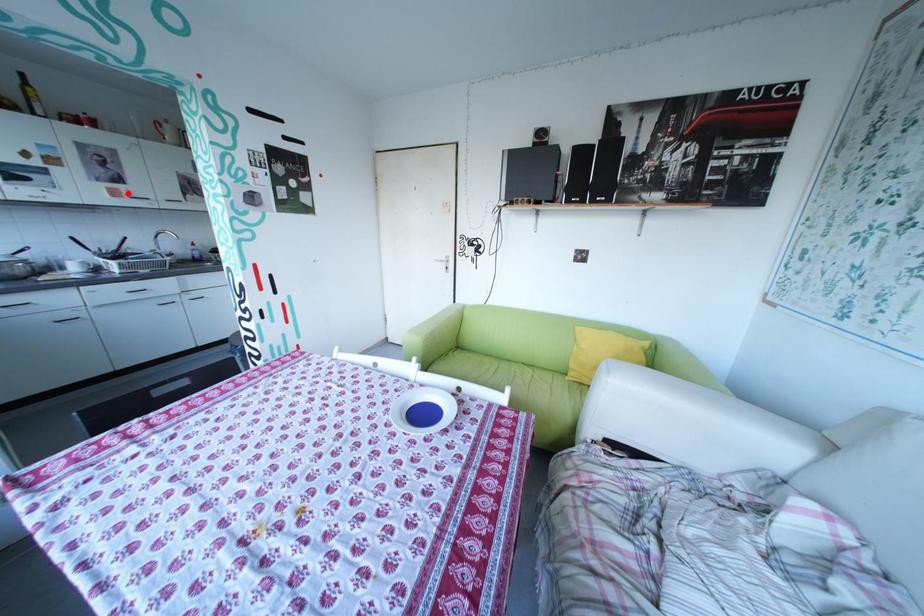
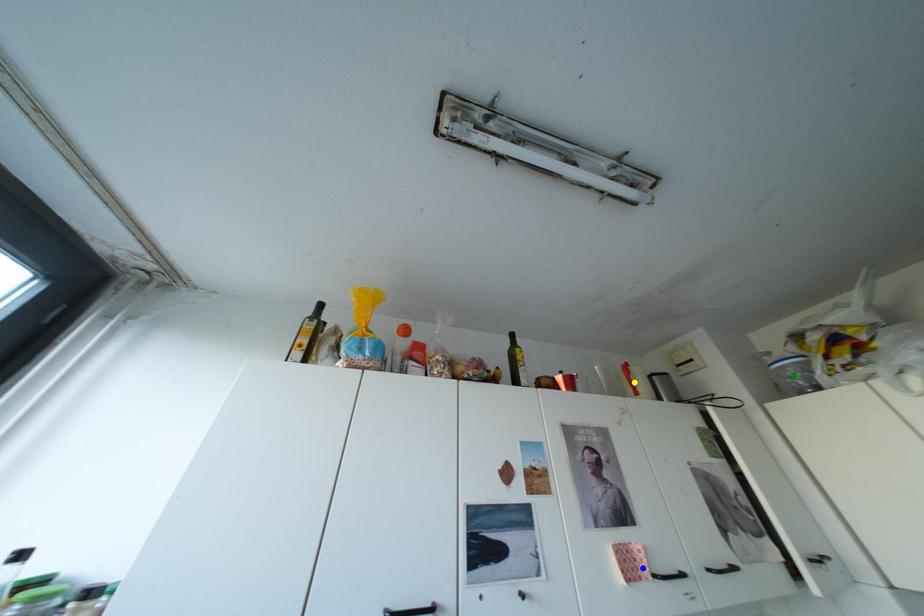
Question: I am providing you with two images of the same scene from different viewpoints. A red point is marked on the first image. You are given multiple points on the second image. Can you choose the point in image 2 that corresponds to the point in image 1?

Choices:
 (A) blue point
 (B) yellow point
 (C) green point

Answer: (A)